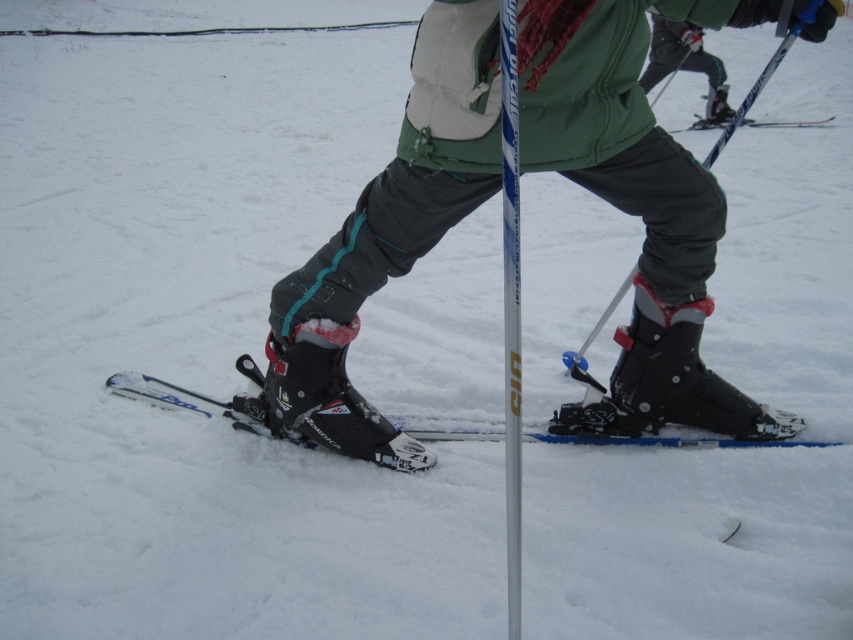
Question: Is matte black ski boot at center to the left of blue metallic ski pole at center from the viewer's perspective?

Choices:
 (A) yes
 (B) no

Answer: (A)

Question: Is black matte ski boot at lower center further to the viewer compared to white plastic pole at center?

Choices:
 (A) yes
 (B) no

Answer: (A)

Question: Which object is positioned closest to the blue metallic ski pole at center?

Choices:
 (A) green fabric jacket at upper center
 (B) white plastic pole at center
 (C) matte black ski boot at center

Answer: (A)

Question: Which of the following is the farthest from the observer?

Choices:
 (A) (683, 45)
 (B) (134, 378)

Answer: (A)

Question: Is matte black ski boot at center bigger than green fabric jacket at upper center?

Choices:
 (A) no
 (B) yes

Answer: (B)

Question: Estimate the real-world distances between objects in this image. Which object is farther from the black matte ski boot at lower right?

Choices:
 (A) blue metallic ski pole at center
 (B) black matte ski at center

Answer: (A)